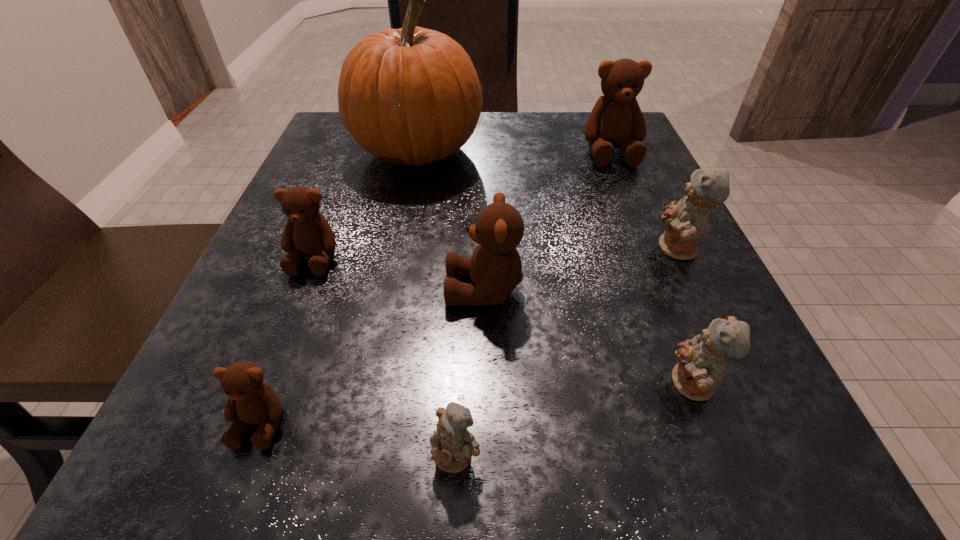
The image size is (960, 540). Find the location of `pumpkin`. pumpkin is located at coordinates (411, 96).

At what (x,y) coordinates should I click in order to perform the action: click on the tallest object. Please return your answer as a coordinate pair (x, y). The width and height of the screenshot is (960, 540). Looking at the image, I should click on (411, 96).

The height and width of the screenshot is (540, 960). What are the coordinates of `the rightmost brown teddy bear` in the screenshot? It's located at (616, 121).

The image size is (960, 540). Identify the location of the second tallest object. (616, 121).

The image size is (960, 540). Find the location of `the rightmost blue teddy bear`. the rightmost blue teddy bear is located at coordinates click(685, 222).

In order to click on the biggest blue teddy bear in this screenshot , I will do `click(685, 222)`.

Where is `the second biggest brown teddy bear`? The width and height of the screenshot is (960, 540). the second biggest brown teddy bear is located at coordinates (495, 268).

I want to click on the second biggest blue teddy bear, so click(701, 366).

At what (x,y) coordinates should I click in order to perform the action: click on the second blue teddy bear from left to right. Please return your answer as a coordinate pair (x, y). The height and width of the screenshot is (540, 960). Looking at the image, I should click on (701, 366).

This screenshot has height=540, width=960. Identify the location of the second smallest brown teddy bear. (307, 232).